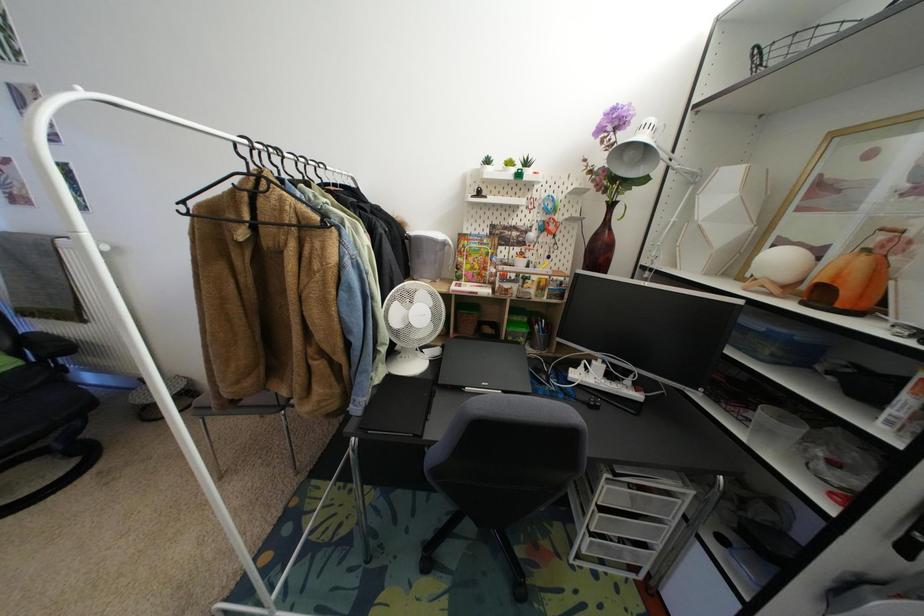
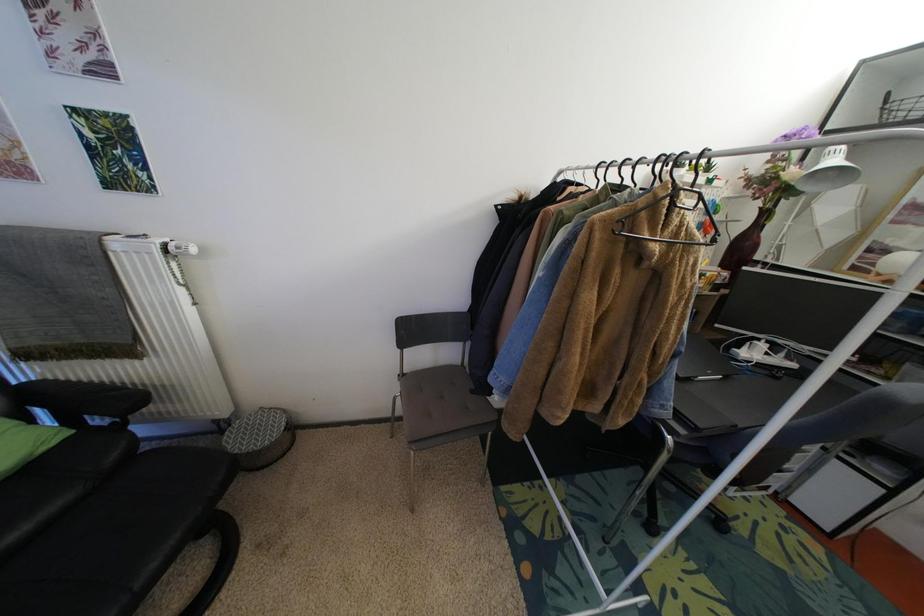
Question: Which direction would the cameraman need to move to produce the second image? Reply with the corresponding letter.

Choices:
 (A) Left
 (B) Right
 (C) Forward
 (D) Backward

Answer: (A)